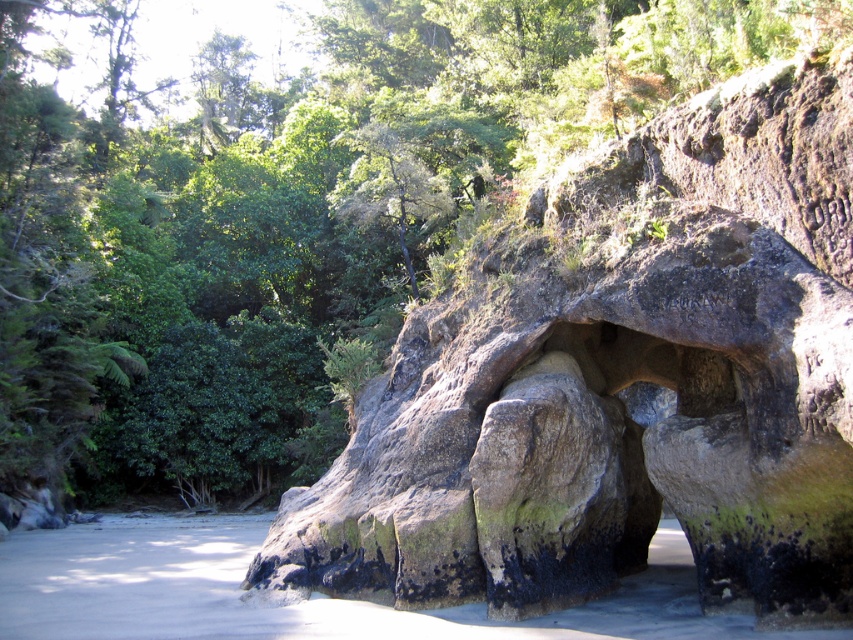
You are standing on the sandy beach and see the rough textured rock at center and the green leafy tree at center. Which object is closer to the ground?

The rough textured rock at center is located below the green leafy tree at center, so the rough textured rock at center is closer to the ground.

You are a photographer planning to capture the rough textured rock at center and the green leafy tree at center in a single frame. Based on their sizes, which object should you focus on to ensure both are clearly visible in the photo?

The rough textured rock at center occupies less space than the green leafy tree at center, so focusing on the green leafy tree at center would help ensure both objects are clearly visible in the photo.

You are standing on the beach and want to take a photo of both the rough textured rock at center and the green leafy tree at center. Since they are positioned in such a way, which one should you focus on first to ensure both are in the frame?

The rough textured rock at center is in front of the green leafy tree at center, so you should focus on the rough textured rock at center first to ensure both are in the frame.